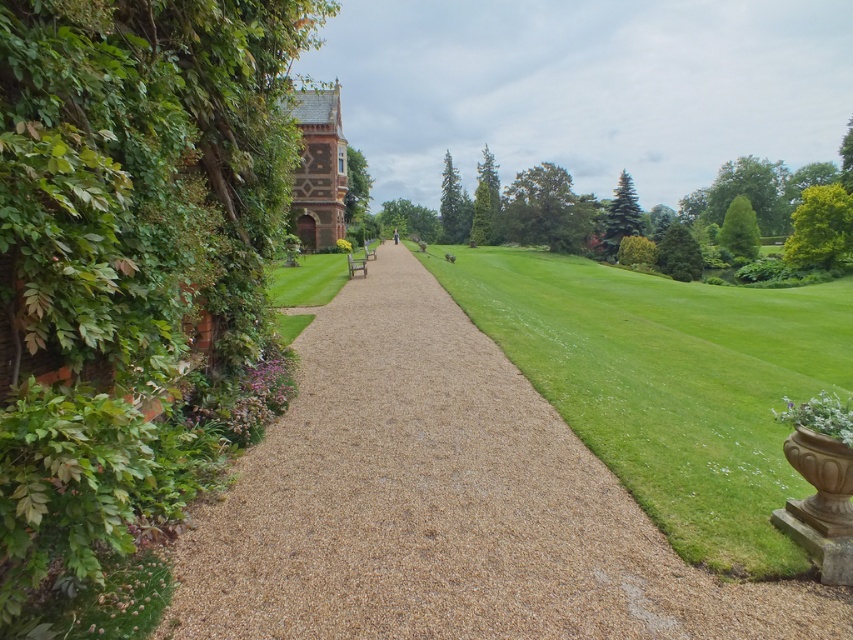
You are standing at the entrance of the garden and see the point marked at coordinates (126,252). What object is located at that position?

The point at coordinates (126,252) indicates a green leafy hedge at left.

From the picture: You are a gardener who wants to trim the green leafy hedge at left and the green grass at center. Based on their positions, which tool should you use for each? Remember, hedges require hedge trimmers and grass needs a lawnmower.

The green leafy hedge at left is on the left side of the green grass at center, so you should use hedge trimmers for the green leafy hedge at left and a lawnmower for the green grass at center.

You are standing on the garden pathway and want to take a photo of both the green leafy hedge at left and the green leafy hedge at right. Based on their positions, which hedge should you focus on first to ensure both are in the frame?

The green leafy hedge at left is located below the green leafy hedge at right, so you should focus on the green leafy hedge at right first to ensure both are in the frame.